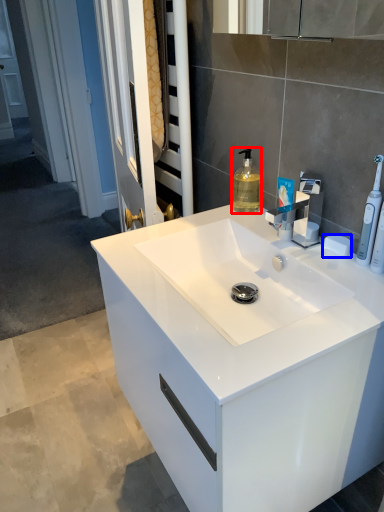
Question: Which of the following is the closest to the observer, soap dispenser (highlighted by a red box) or soap (highlighted by a blue box)?

Choices:
 (A) soap dispenser
 (B) soap

Answer: (B)